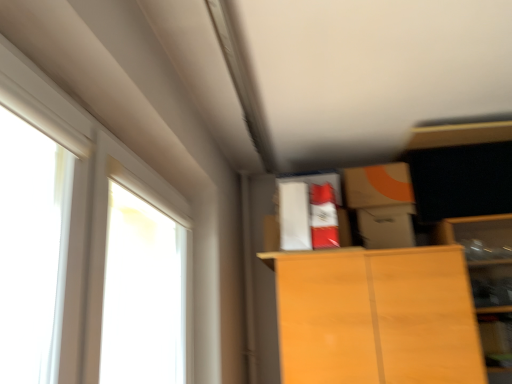
Question: Is white glossy window at left, arranged as the second window when viewed from the back, in front of or behind white glossy window at upper left, the 1th window from the back, in the image?

Choices:
 (A) front
 (B) behind

Answer: (A)

Question: Is white glossy window at left, the first window viewed from the front, to the left or to the right of white glossy window at upper left, the second window viewed from the front, in the image?

Choices:
 (A) right
 (B) left

Answer: (B)

Question: Considering the positions of white glossy window at left, the first window viewed from the front, and white glossy window at upper left, the second window viewed from the front, in the image, is white glossy window at left, the first window viewed from the front, taller or shorter than white glossy window at upper left, the second window viewed from the front,?

Choices:
 (A) tall
 (B) short

Answer: (B)

Question: In terms of height, does white glossy window at upper left, the 1th window from the back, look taller or shorter compared to white glossy window at left, the first window viewed from the front?

Choices:
 (A) tall
 (B) short

Answer: (A)

Question: Is white glossy window at upper left, the second window viewed from the front, wider or thinner than white glossy window at left, the first window viewed from the front?

Choices:
 (A) thin
 (B) wide

Answer: (B)

Question: Considering the relative positions of white glossy window at upper left, the 1th window from the back, and white glossy window at left, arranged as the second window when viewed from the back, in the image provided, is white glossy window at upper left, the 1th window from the back, to the left or to the right of white glossy window at left, arranged as the second window when viewed from the back,?

Choices:
 (A) right
 (B) left

Answer: (A)

Question: In the image, is white glossy window at upper left, the 1th window from the back, positioned in front of or behind white glossy window at left, the first window viewed from the front?

Choices:
 (A) behind
 (B) front

Answer: (A)